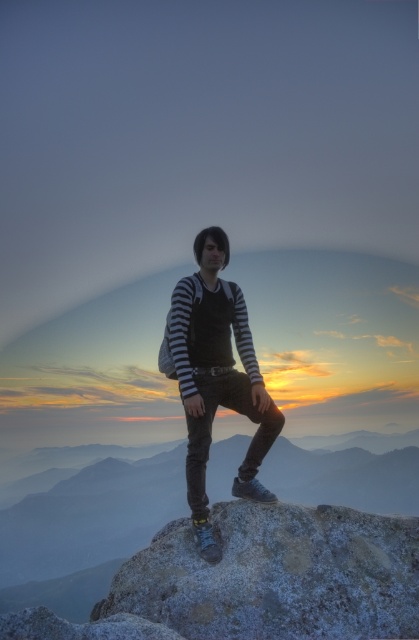
Question: Among these objects, which one is farthest from the camera?

Choices:
 (A) frosty rock at center
 (B) striped fabric shirt at center

Answer: (B)

Question: Is frosty rock at center positioned before striped fabric shirt at center?

Choices:
 (A) yes
 (B) no

Answer: (A)

Question: Is the position of frosty rock at center less distant than that of striped fabric shirt at center?

Choices:
 (A) yes
 (B) no

Answer: (A)

Question: Is frosty rock at center further to the viewer compared to striped fabric shirt at center?

Choices:
 (A) no
 (B) yes

Answer: (A)